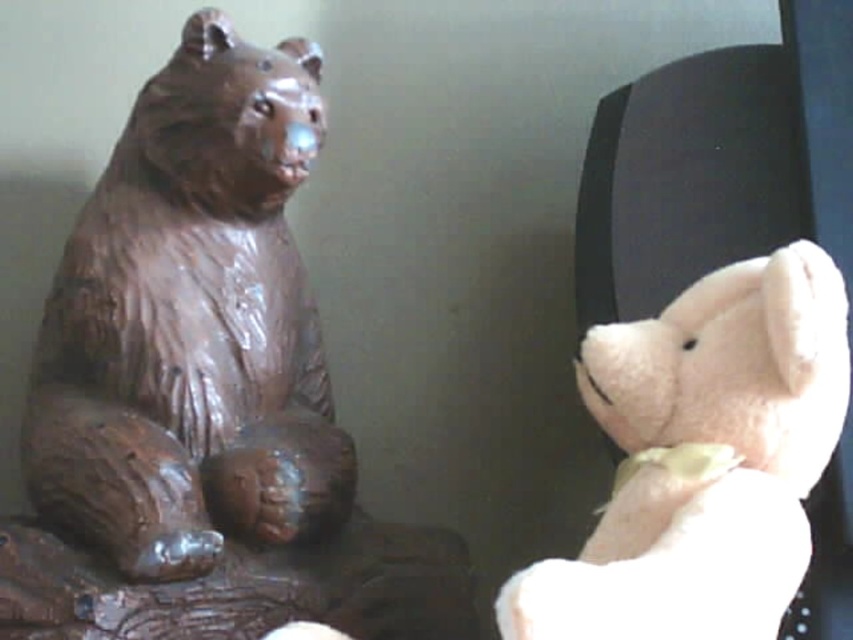
Based on the photo, who is more distant from viewer, (91, 280) or (601, 566)?

The point (91, 280) is behind.

Can you confirm if matte wood bear at left is wider than fluffy white teddy bear at right?

In fact, matte wood bear at left might be narrower than fluffy white teddy bear at right.

Image resolution: width=853 pixels, height=640 pixels. What are the coordinates of `matte wood bear at left` in the screenshot? It's located at (190, 323).